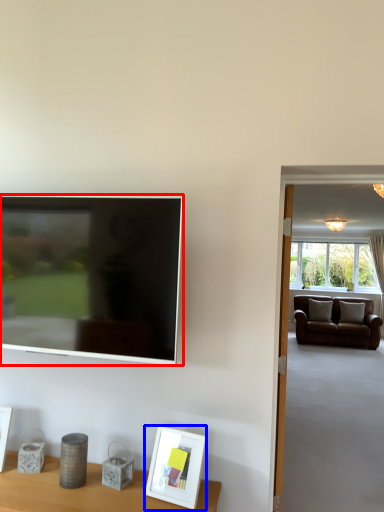
Question: Which object is closer to the camera taking this photo, television (highlighted by a red box) or picture frame (highlighted by a blue box)?

Choices:
 (A) television
 (B) picture frame

Answer: (B)